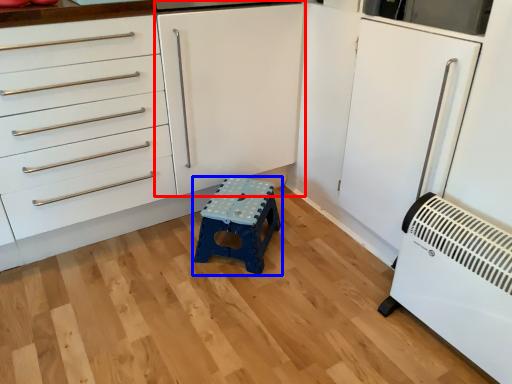
Question: Which of the following is the farthest to the observer, cabinetry (highlighted by a red box) or furniture (highlighted by a blue box)?

Choices:
 (A) cabinetry
 (B) furniture

Answer: (B)